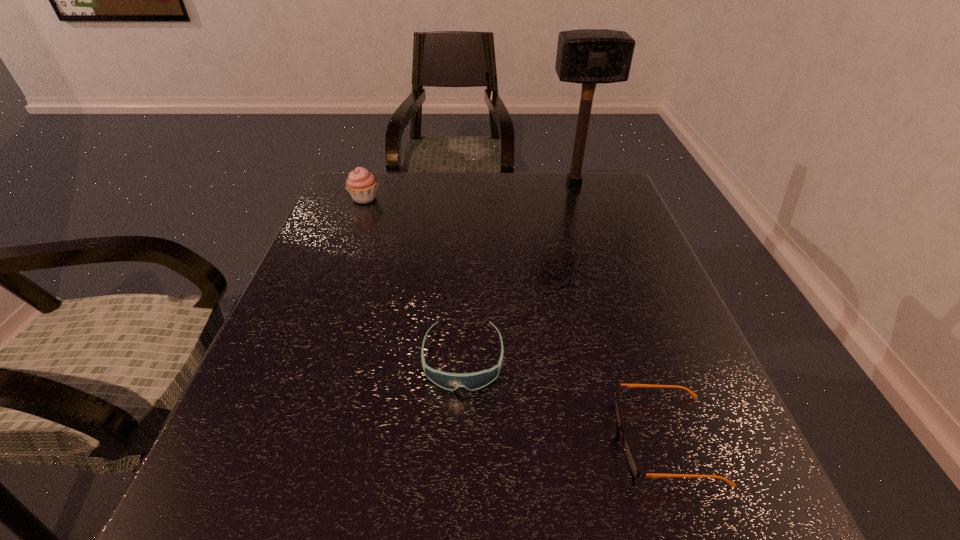
Where is `free spot between the spectacles and the mallet`? The height and width of the screenshot is (540, 960). free spot between the spectacles and the mallet is located at coordinates pyautogui.click(x=620, y=311).

This screenshot has width=960, height=540. I want to click on unoccupied area between the tallest object and the second object from left to right, so click(x=518, y=272).

You are a GUI agent. You are given a task and a screenshot of the screen. Output one action in this format:
    pyautogui.click(x=<x>, y=<y>)
    Task: Click on the unoccupied area between the spectacles and the tallest object
    
    Given the screenshot: What is the action you would take?
    pyautogui.click(x=620, y=311)

This screenshot has width=960, height=540. What are the coordinates of `empty location between the third tallest object and the tallest object` in the screenshot? It's located at (518, 272).

Where is `vacant region between the third shortest object and the tallest object`? The width and height of the screenshot is (960, 540). vacant region between the third shortest object and the tallest object is located at coordinates (469, 191).

Find the location of `vacant space that's between the tallest object and the nearest object`. vacant space that's between the tallest object and the nearest object is located at coordinates (620, 311).

Locate an element on the screen. Image resolution: width=960 pixels, height=540 pixels. vacant space that is in between the second tallest object and the shortest object is located at coordinates click(515, 319).

Locate an element on the screen. vacant area between the shortest object and the mallet is located at coordinates (620, 311).

Choose which object is the second nearest neighbor to the spectacles. Please provide its 2D coordinates. Your answer should be formatted as a tuple, i.e. [(x, y)], where the tuple contains the x and y coordinates of a point satisfying the conditions above.

[(589, 56)]

What are the coordinates of `the closest object to the mallet` in the screenshot? It's located at (361, 184).